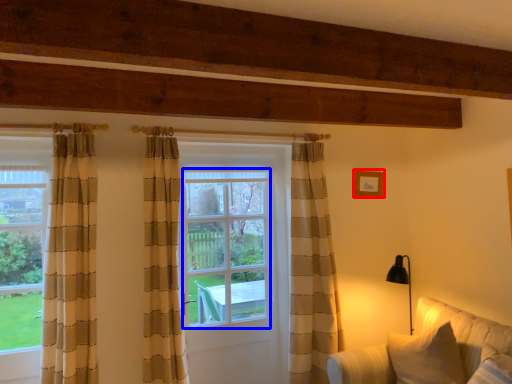
Question: Among these objects, which one is nearest to the camera, picture frame (highlighted by a red box) or window screen (highlighted by a blue box)?

Choices:
 (A) picture frame
 (B) window screen

Answer: (B)